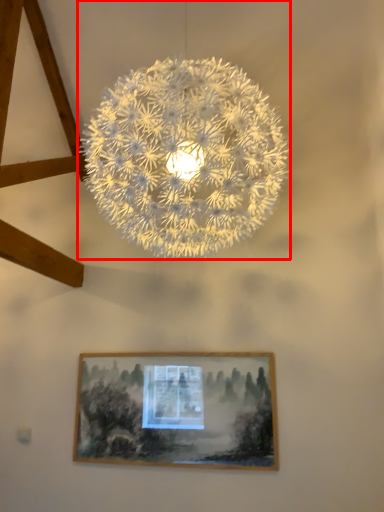
Question: From the image's perspective, what is the correct spatial positioning of lamp (annotated by the red box) in reference to picture frame?

Choices:
 (A) above
 (B) below

Answer: (A)